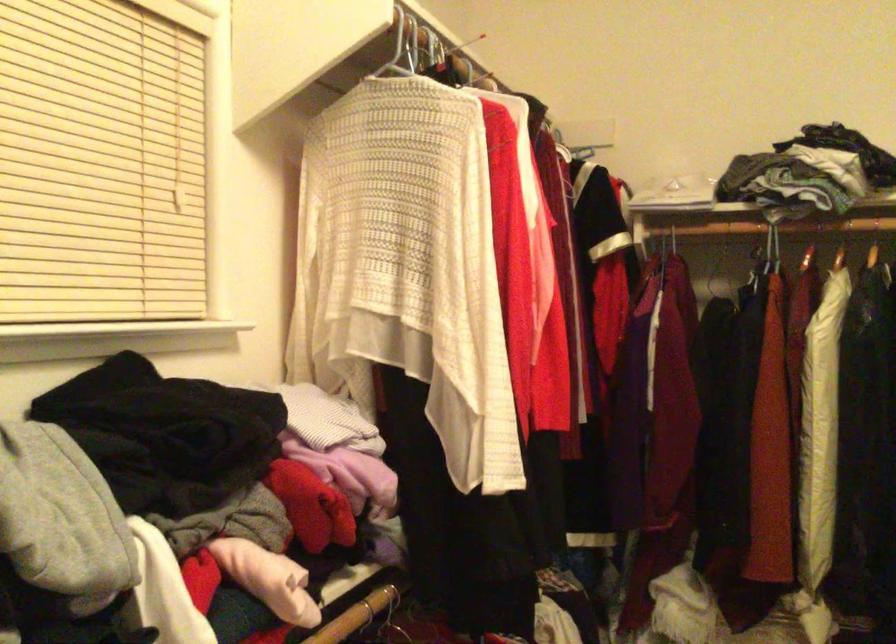
Where is `window blind pull cord`? window blind pull cord is located at coordinates (177, 129).